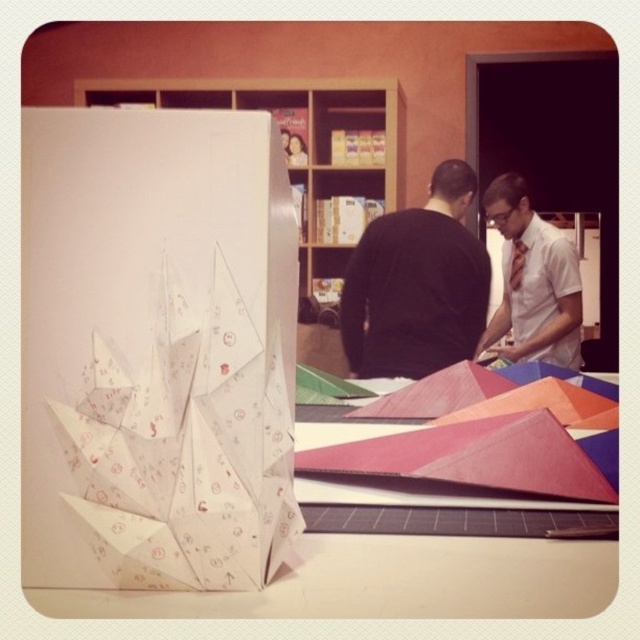
Between black matte shirt at center and white cardboard at upper center, which one has less height?

With less height is black matte shirt at center.

Based on the photo, can you confirm if black matte shirt at center is positioned to the right of white cardboard at upper center?

Indeed, black matte shirt at center is positioned on the right side of white cardboard at upper center.

The height and width of the screenshot is (640, 640). What do you see at coordinates (417, 284) in the screenshot?
I see `black matte shirt at center` at bounding box center [417, 284].

Locate an element on the screen. The height and width of the screenshot is (640, 640). black matte shirt at center is located at coordinates (417, 284).

Is point (458, 502) closer to camera compared to point (545, 340)?

Yes, point (458, 502) is in front of point (545, 340).

Is white paper table at center to the left of matte white shirt at center from the viewer's perspective?

Correct, you'll find white paper table at center to the left of matte white shirt at center.

Is point (333, 618) closer to viewer compared to point (525, 262)?

Yes, point (333, 618) is in front of point (525, 262).

Locate an element on the screen. white paper table at center is located at coordinates (387, 582).

At what (x,y) coordinates should I click in order to perform the action: click on white cardboard at upper center. Please return your answer as a coordinate pair (x, y). Image resolution: width=640 pixels, height=640 pixels. Looking at the image, I should click on (300, 145).

Is white cardboard at upper center positioned before matte white shirt at center?

No, white cardboard at upper center is further to the viewer.

Locate an element on the screen. The height and width of the screenshot is (640, 640). white cardboard at upper center is located at coordinates (300, 145).